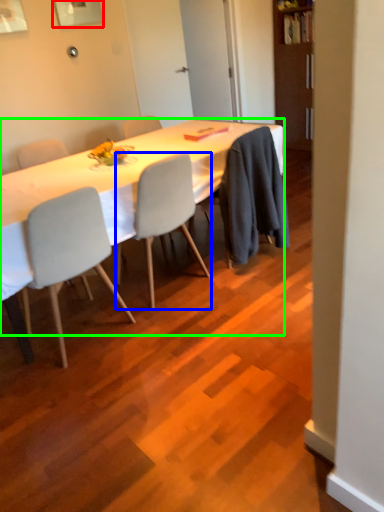
Question: Which object is the closest to the picture frame (highlighted by a red box)? Choose among these: chair (highlighted by a blue box) or desk (highlighted by a green box).

Choices:
 (A) chair
 (B) desk

Answer: (B)